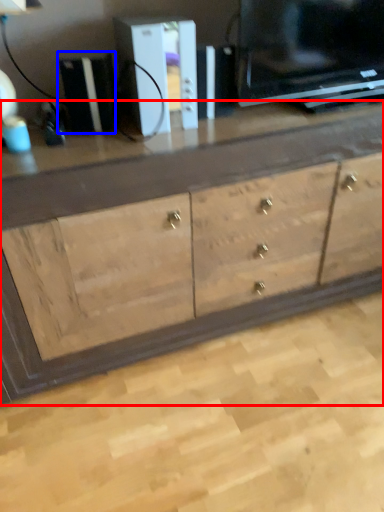
Question: Among these objects, which one is nearest to the camera, chest of drawers (highlighted by a red box) or appliance (highlighted by a blue box)?

Choices:
 (A) chest of drawers
 (B) appliance

Answer: (A)